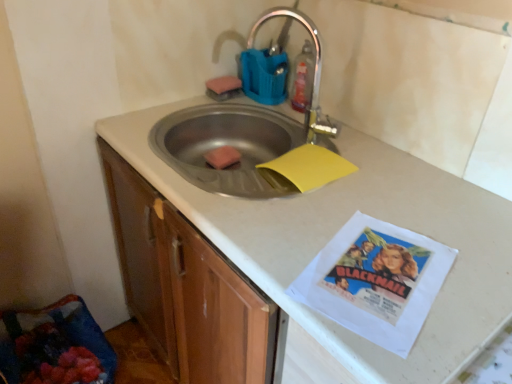
Locate an element on the screen. vacant area that lies between pink sponge at upper center, the 1th food viewed from the top, and translucent plastic bottle at upper center is located at coordinates (262, 103).